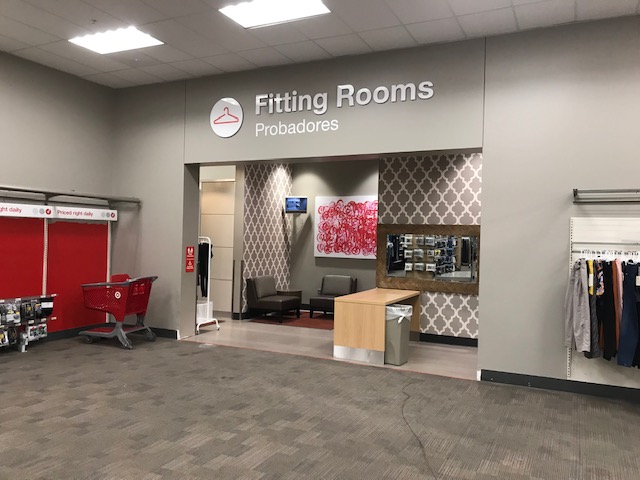
Find the location of a particular element. This screenshot has height=480, width=640. probadores is located at coordinates (307, 132).